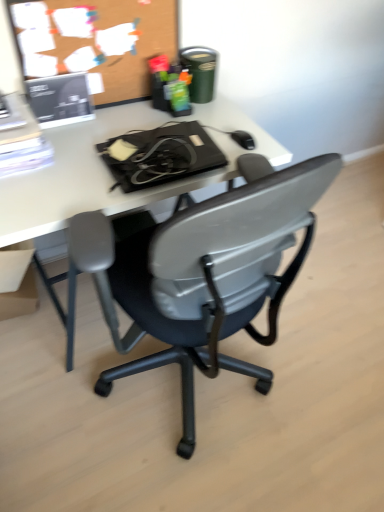
The height and width of the screenshot is (512, 384). I want to click on empty space that is ontop of black plastic chair at center (from a real-world perspective), so click(x=296, y=333).